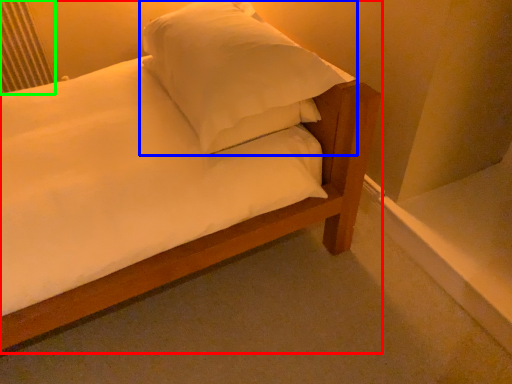
Question: Which object is the farthest from bed (highlighted by a red box)? Choose among these: pillow (highlighted by a blue box) or radiator (highlighted by a green box).

Choices:
 (A) pillow
 (B) radiator

Answer: (B)